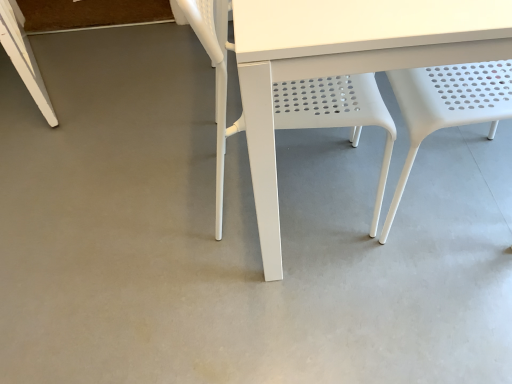
Where is `vacant area situated below white perforated plastic chair at center, which is the first chair in right-to-left order (from a real-world perspective)`? This screenshot has width=512, height=384. vacant area situated below white perforated plastic chair at center, which is the first chair in right-to-left order (from a real-world perspective) is located at coordinates (454, 188).